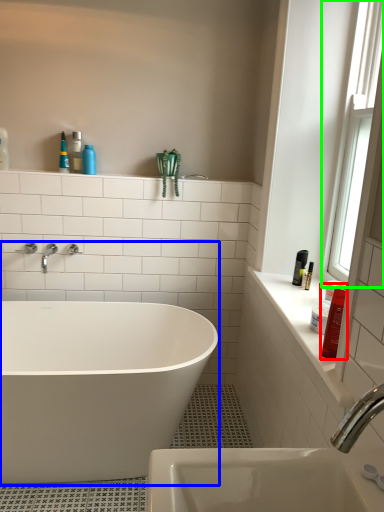
Question: Which object is the closest to the toiletry (highlighted by a red box)? Choose among these: bathtub (highlighted by a blue box) or window (highlighted by a green box).

Choices:
 (A) bathtub
 (B) window

Answer: (B)